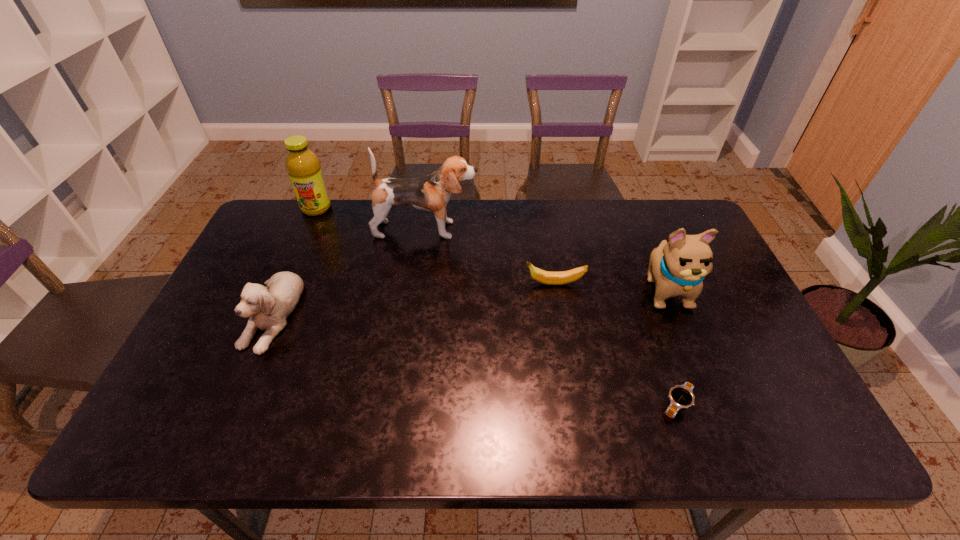
Locate an element on the screen. This screenshot has height=540, width=960. object that is at the near edge is located at coordinates tap(681, 396).

Locate an element on the screen. The width and height of the screenshot is (960, 540). fruit juice that is positioned at the left edge is located at coordinates (304, 169).

This screenshot has height=540, width=960. Identify the location of puppy that is at the left edge. (268, 307).

This screenshot has width=960, height=540. What are the coordinates of `object that is positioned at the right edge` in the screenshot? It's located at (678, 268).

Image resolution: width=960 pixels, height=540 pixels. Identify the location of object present at the far left corner. (304, 169).

Locate an element on the screen. The width and height of the screenshot is (960, 540). vacant region at the far edge of the desktop is located at coordinates (450, 227).

You are a GUI agent. You are given a task and a screenshot of the screen. Output one action in this format:
    pyautogui.click(x=<x>, y=<y>)
    Task: Click on the free space at the near edge of the desktop
    The width and height of the screenshot is (960, 540).
    Given the screenshot: What is the action you would take?
    tap(329, 414)

Where is `vacant space at the left edge of the desktop`? This screenshot has height=540, width=960. vacant space at the left edge of the desktop is located at coordinates (243, 290).

You are a GUI agent. You are given a task and a screenshot of the screen. Output one action in this format:
    pyautogui.click(x=<x>, y=<y>)
    Task: Click on the vacant region at the right edge of the desktop
    The image size is (960, 540).
    Given the screenshot: What is the action you would take?
    pyautogui.click(x=788, y=382)

This screenshot has width=960, height=540. In the image, there is a desktop. Find the location of `free space at the near right corner`. free space at the near right corner is located at coordinates (746, 414).